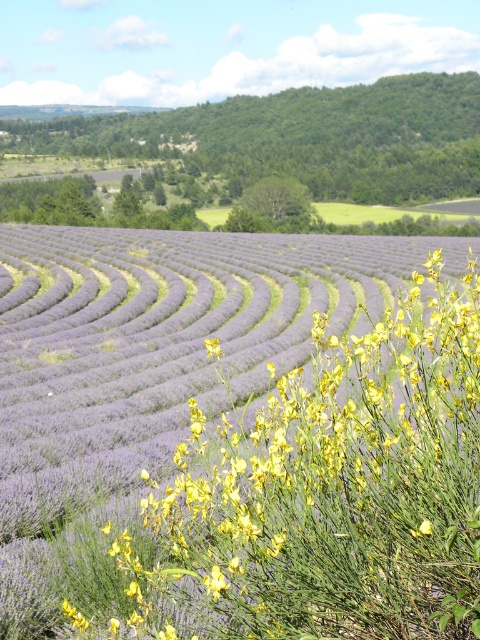
Question: Which of the following is the closest to the observer?

Choices:
 (A) (320, 189)
 (B) (148, 260)

Answer: (B)

Question: Does purple soft lavender at center have a greater width compared to green leafy hillside at upper center?

Choices:
 (A) no
 (B) yes

Answer: (A)

Question: Which object is farther from the camera taking this photo?

Choices:
 (A) green leafy hillside at upper center
 (B) purple soft lavender at center

Answer: (A)

Question: In this image, where is purple soft lavender at center located relative to green leafy hillside at upper center?

Choices:
 (A) above
 (B) below

Answer: (B)

Question: Is purple soft lavender at center closer to the viewer compared to green leafy hillside at upper center?

Choices:
 (A) no
 (B) yes

Answer: (B)